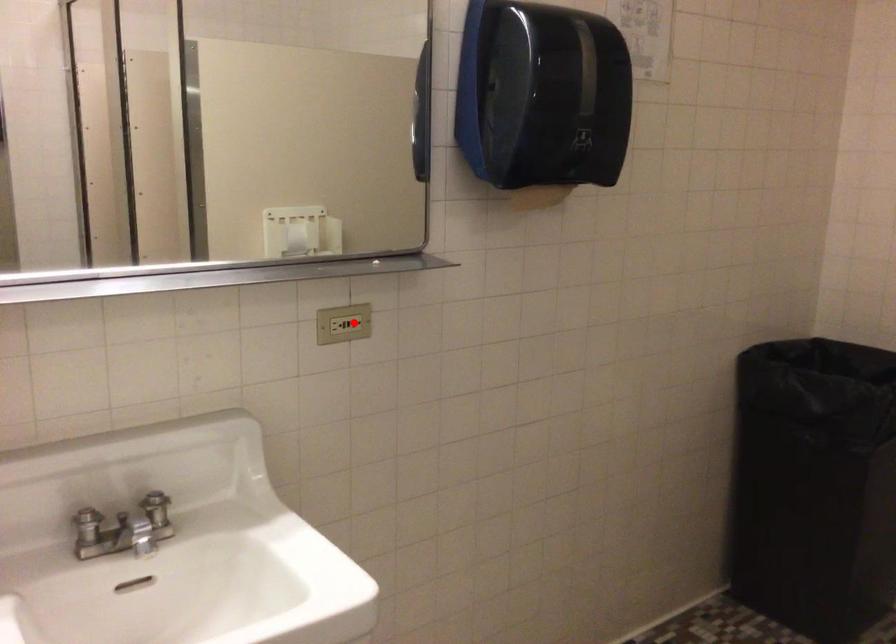
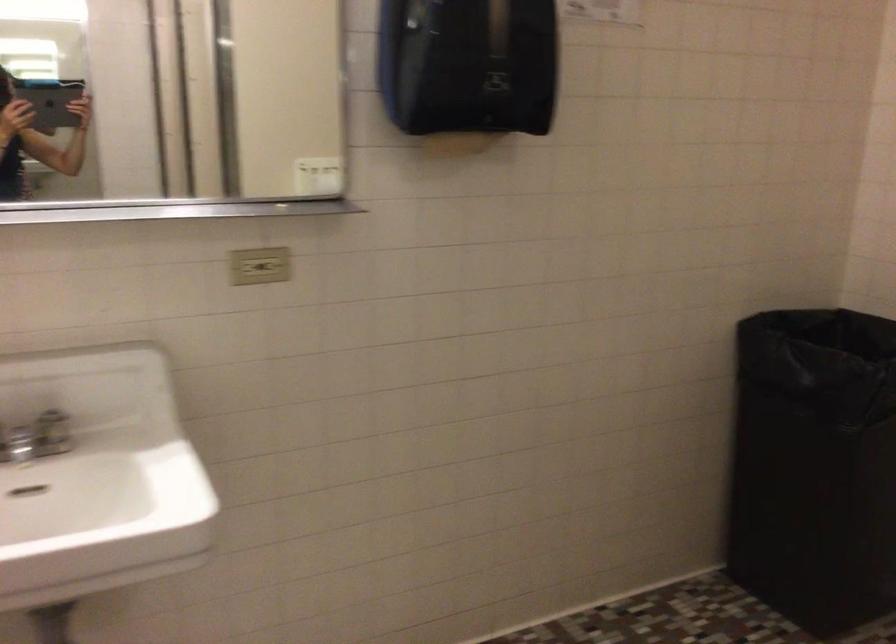
Question: I am providing you with two images of the same scene from different viewpoints. A red point is marked on the first image. Can you still see the location of the red point in image 2?

Choices:
 (A) Yes
 (B) No

Answer: (A)